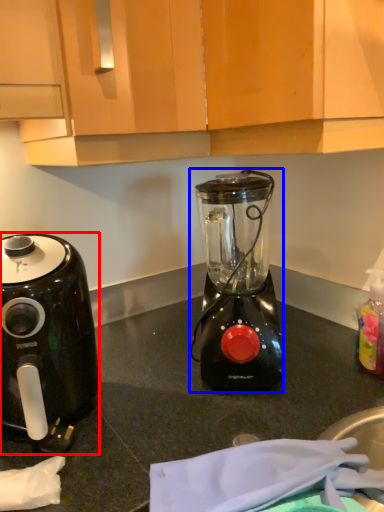
Question: Which object appears farthest to the camera in this image, coffee maker (highlighted by a red box) or blender (highlighted by a blue box)?

Choices:
 (A) coffee maker
 (B) blender

Answer: (B)